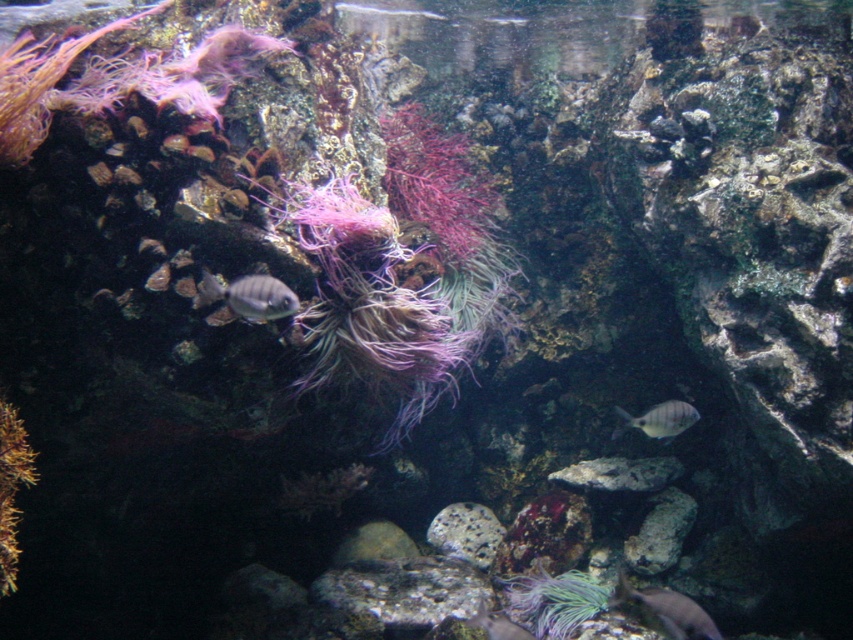
Question: Which of the following is the farthest from the observer?

Choices:
 (A) (618, 408)
 (B) (465, 502)
 (C) (264, 275)
 (D) (363, 371)

Answer: (B)

Question: Is shiny silver fish at center positioned at the back of matte silver fish at lower right?

Choices:
 (A) yes
 (B) no

Answer: (B)

Question: Can you confirm if purple soft coral at center is positioned to the right of shiny silver fish at center?

Choices:
 (A) no
 (B) yes

Answer: (B)

Question: Among these points, which one is nearest to the camera?

Choices:
 (A) (650, 500)
 (B) (210, 292)
 (C) (693, 406)

Answer: (B)

Question: Does smooth gray rock at center appear under speckled rock at center?

Choices:
 (A) yes
 (B) no

Answer: (B)

Question: Based on their relative distances, which object is farther from the speckled rock at center?

Choices:
 (A) smooth gray rock at center
 (B) silvery metallic fish at lower center
 (C) matte silver fish at lower right
 (D) shiny silver fish at center

Answer: (D)